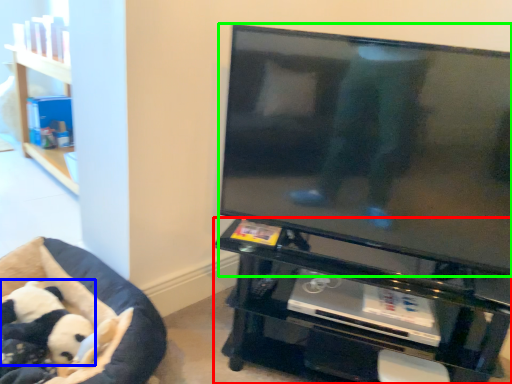
Question: Estimate the real-world distances between objects in this image. Which object is farther from furniture (highlighted by a red box), panda (highlighted by a blue box) or television (highlighted by a green box)?

Choices:
 (A) panda
 (B) television

Answer: (A)